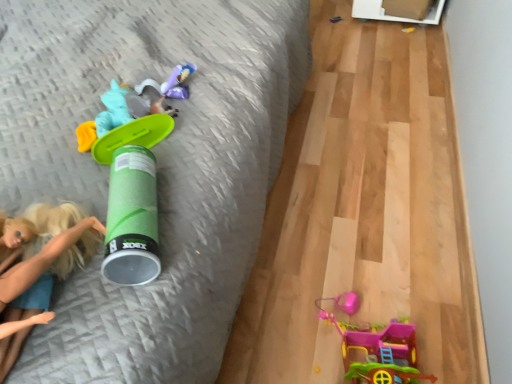
At what (x,y) coordinates should I click in order to perform the action: click on vacant space behind plastic pink toy house at lower right, which ranks as the 4th toy in back-to-front order. Please return your answer as a coordinate pair (x, y). Looking at the image, I should click on (352, 255).